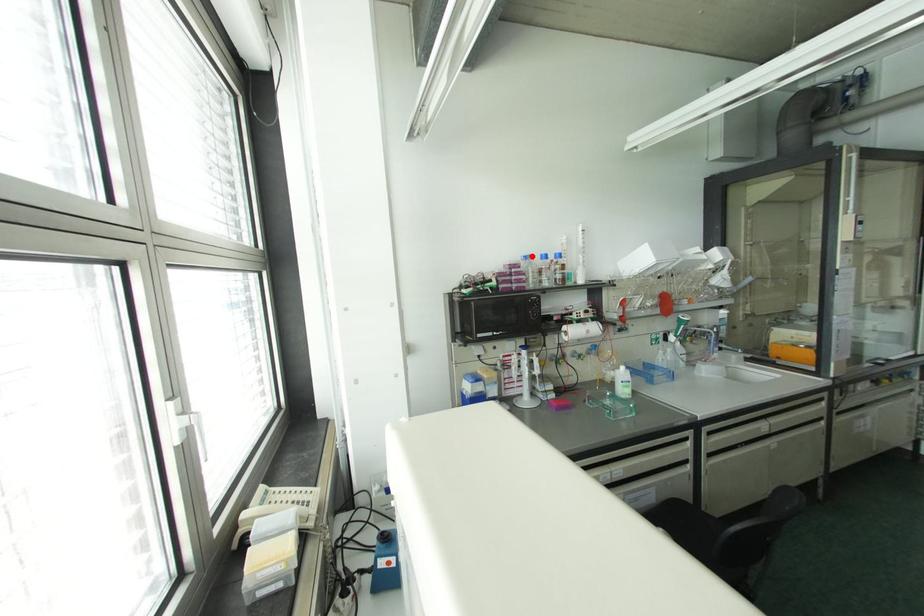
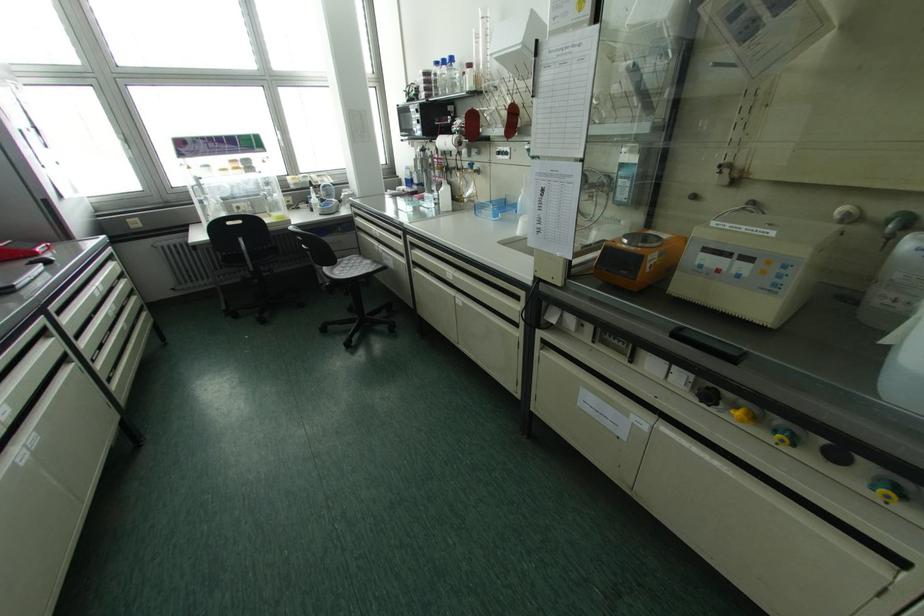
The point at the highlighted location is marked in the first image. Where is the corresponding point in the second image?

(435, 63)